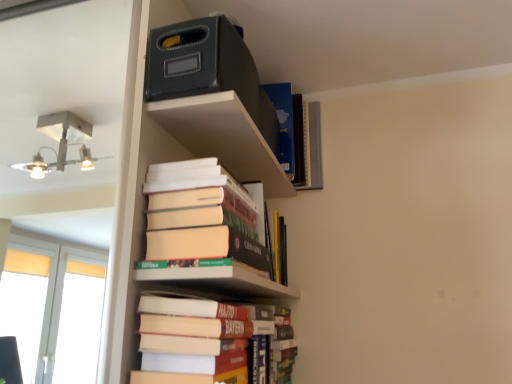
Question: From a real-world perspective, is hardcover book at upper center, marked as the third book in a bottom-to-top arrangement, over hardcover books at lower center, which is counted as the 1th book, starting from the bottom?

Choices:
 (A) yes
 (B) no

Answer: (A)

Question: Considering the relative sizes of hardcover book at upper center, marked as the third book in a bottom-to-top arrangement, and hardcover books at lower center, the 3th book positioned from the top, in the image provided, is hardcover book at upper center, marked as the third book in a bottom-to-top arrangement, shorter than hardcover books at lower center, the 3th book positioned from the top,?

Choices:
 (A) no
 (B) yes

Answer: (A)

Question: From the image's perspective, is hardcover book at upper center, the 1th book positioned from the top, on top of hardcover books at lower center, the 3th book positioned from the top?

Choices:
 (A) no
 (B) yes

Answer: (B)

Question: Does hardcover book at upper center, the 1th book positioned from the top, have a lesser width compared to hardcover books at lower center, the 3th book positioned from the top?

Choices:
 (A) yes
 (B) no

Answer: (B)

Question: Can we say hardcover book at upper center, marked as the third book in a bottom-to-top arrangement, lies outside hardcover books at lower center, the 3th book positioned from the top?

Choices:
 (A) no
 (B) yes

Answer: (B)

Question: Based on their sizes in the image, would you say hardcover books at lower center, which is counted as the 1th book, starting from the bottom, is bigger or smaller than hardcover book at center?

Choices:
 (A) big
 (B) small

Answer: (A)

Question: Considering the relative positions of hardcover books at lower center, the 3th book positioned from the top, and hardcover book at center in the image provided, is hardcover books at lower center, the 3th book positioned from the top, to the left or to the right of hardcover book at center?

Choices:
 (A) left
 (B) right

Answer: (B)

Question: Is hardcover books at lower center, which is counted as the 1th book, starting from the bottom, taller or shorter than hardcover book at center?

Choices:
 (A) short
 (B) tall

Answer: (B)

Question: From the image's perspective, is hardcover books at lower center, the 3th book positioned from the top, located above or below hardcover book at center?

Choices:
 (A) below
 (B) above

Answer: (A)

Question: From a real-world perspective, is hardcover books at center, the 2th book positioned from the top, above or below hardcover book at upper center, the 1th book positioned from the top?

Choices:
 (A) below
 (B) above

Answer: (A)

Question: Is hardcover books at center, which is counted as the 2th book, starting from the bottom, bigger or smaller than hardcover book at upper center, marked as the third book in a bottom-to-top arrangement?

Choices:
 (A) big
 (B) small

Answer: (A)

Question: From the image's perspective, is hardcover books at center, which is counted as the 2th book, starting from the bottom, above or below hardcover book at upper center, marked as the third book in a bottom-to-top arrangement?

Choices:
 (A) above
 (B) below

Answer: (B)

Question: Looking at their shapes, would you say hardcover books at center, the 2th book positioned from the top, is wider or thinner than hardcover book at upper center, the 1th book positioned from the top?

Choices:
 (A) wide
 (B) thin

Answer: (B)

Question: Is hardcover books at lower center, the 3th book positioned from the top, inside or outside of hardcover books at center, which is counted as the 2th book, starting from the bottom?

Choices:
 (A) outside
 (B) inside

Answer: (A)

Question: Looking at the image, does hardcover books at lower center, the 3th book positioned from the top, seem bigger or smaller compared to hardcover books at center, which is counted as the 2th book, starting from the bottom?

Choices:
 (A) big
 (B) small

Answer: (B)